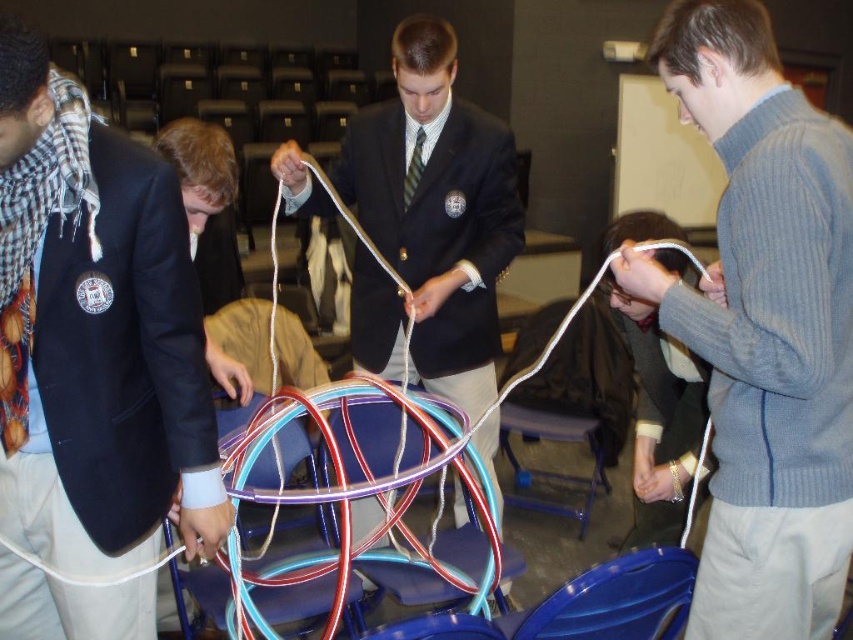
Question: Which of the following is the closest to the observer?

Choices:
 (A) white matte cord at lower right
 (B) matte black blazer at left
 (C) gray wool sweater at center
 (D) translucent rubber band at center

Answer: (B)

Question: Among these objects, which one is nearest to the camera?

Choices:
 (A) translucent rubber band at lower center
 (B) translucent rubber band at center

Answer: (B)

Question: Which object is positioned farthest from the white matte cord at lower right?

Choices:
 (A) matte black suit at center
 (B) translucent rubber band at center
 (C) gold metallic elastic band at lower center

Answer: (B)

Question: Can you confirm if matte black blazer at left is positioned above gold metallic elastic band at lower center?

Choices:
 (A) yes
 (B) no

Answer: (A)

Question: Can you confirm if gray wool sweater at center is positioned to the right of translucent rubber band at center?

Choices:
 (A) no
 (B) yes

Answer: (B)

Question: Is white matte cord at lower right wider than gold metallic bracelet at upper center?

Choices:
 (A) no
 (B) yes

Answer: (B)